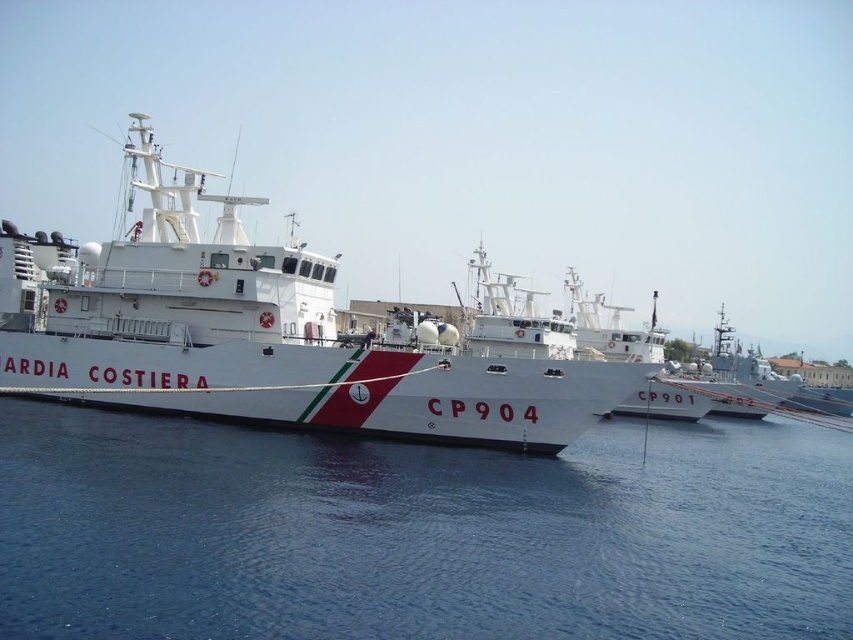
You are a port authority inspector tasked with ensuring safe navigation. You need to assess if the blue water at lower left has enough width to allow a small boat to pass safely between it and the white glossy ship at center. Can you confirm if there is sufficient space?

The blue water at lower left might be wider than white glossy ship at center, so there is likely enough space for a small boat to pass safely between them.

You are a port authority official assessing the docking layout. You observe the blue water at lower left and the white glossy ship at center. Which one has a greater height in the image?

The white glossy ship at center has a greater height compared to the blue water at lower left.

You are standing on the dock and looking at the blue water at lower left and the white glossy ship at center. Which object is nearer to you?

The blue water at lower left is closer to the viewer than the white glossy ship at center.